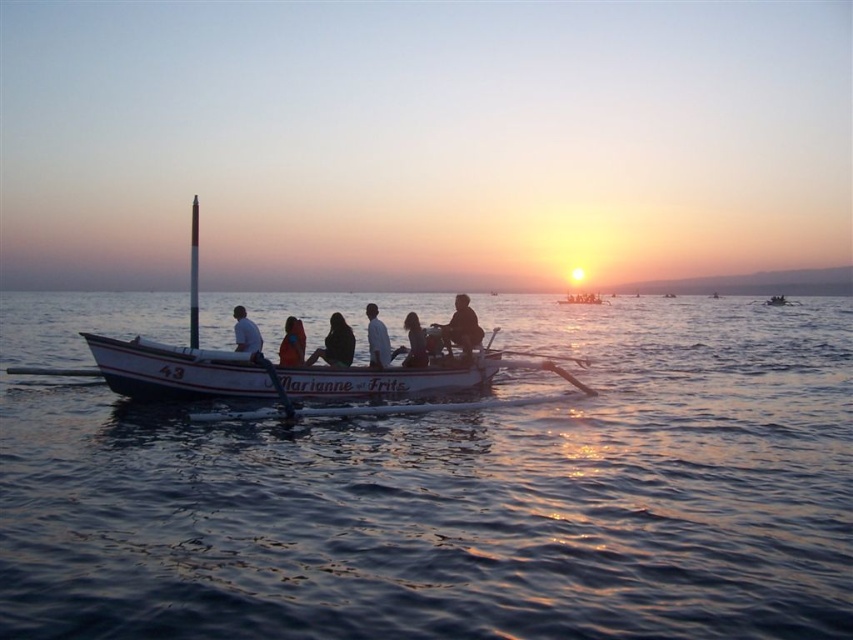
Can you confirm if dark brown leather jacket at center is taller than white cotton shirt at center?

No, dark brown leather jacket at center is not taller than white cotton shirt at center.

Between point (323, 348) and point (380, 332), which one is positioned behind?

Point (323, 348)

The height and width of the screenshot is (640, 853). In order to click on dark brown leather jacket at center in this screenshot , I will do `click(335, 342)`.

Between white wooden boat at center and white matte shirt at center, which one appears on the left side from the viewer's perspective?

From the viewer's perspective, white wooden boat at center appears more on the left side.

Identify the location of white wooden boat at center. This screenshot has height=640, width=853. (177, 358).

Is dark brown leather jacket at center bigger than wooden paddle at center?

Incorrect, dark brown leather jacket at center is not larger than wooden paddle at center.

Who is shorter, dark brown leather jacket at center or wooden paddle at center?

dark brown leather jacket at center is shorter.

Between point (338, 348) and point (271, 369), which one is positioned in front?

Point (271, 369) is more forward.

Find the location of `dark brown leather jacket at center`. dark brown leather jacket at center is located at coordinates (335, 342).